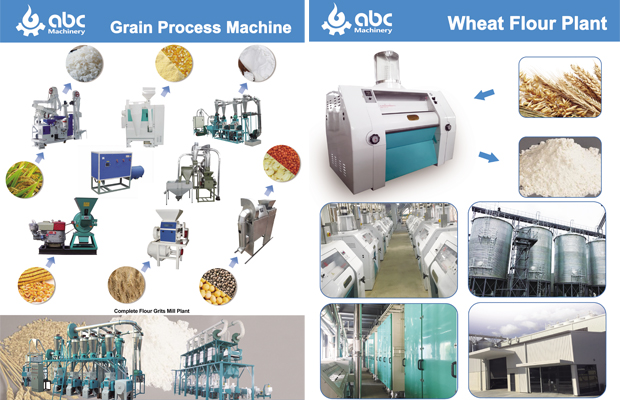
You are a GUI agent. You are given a task and a screenshot of the screen. Output one action in this format:
    pyautogui.click(x=<x>, y=<y>)
    Task: Click on the inside view of bulding
    This screenshot has height=400, width=620.
    Given the screenshot: What is the action you would take?
    pyautogui.click(x=418, y=378), pyautogui.click(x=392, y=274)